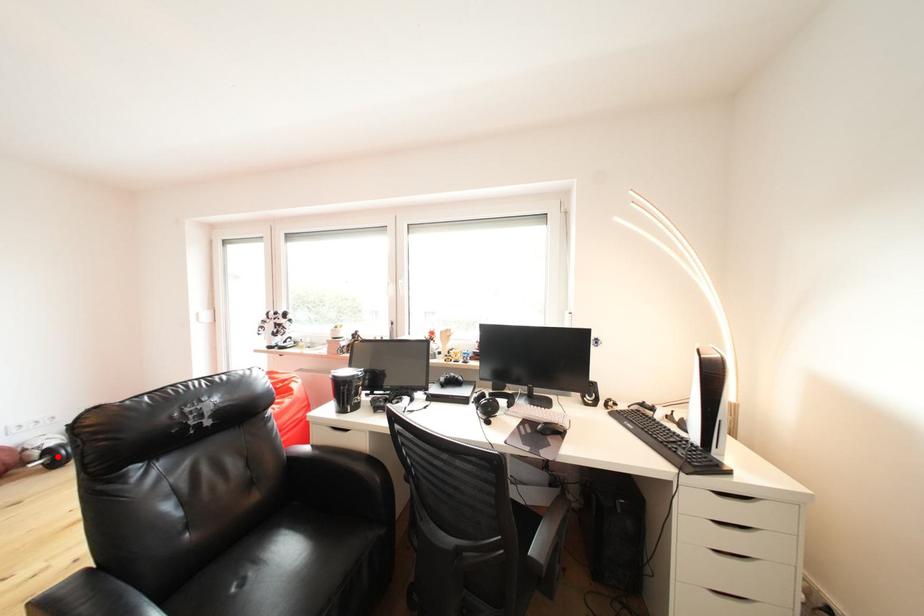
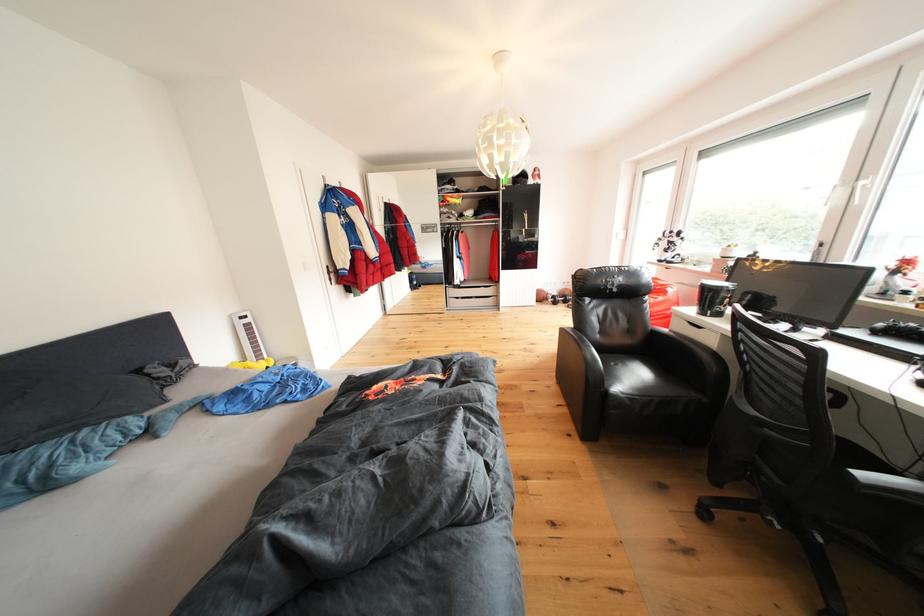
Question: I am providing you with two images of the same scene from different viewpoints. Image1 has a red point marked. In image2, the corresponding 3D location appears at what relative position? Reply with the corresponding letter.

Choices:
 (A) Closer
 (B) Farther

Answer: (B)